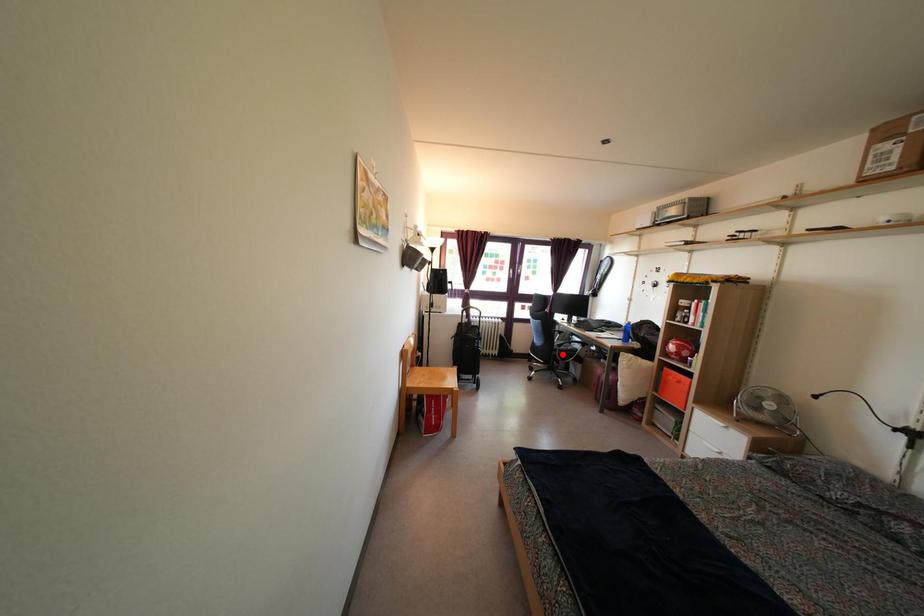
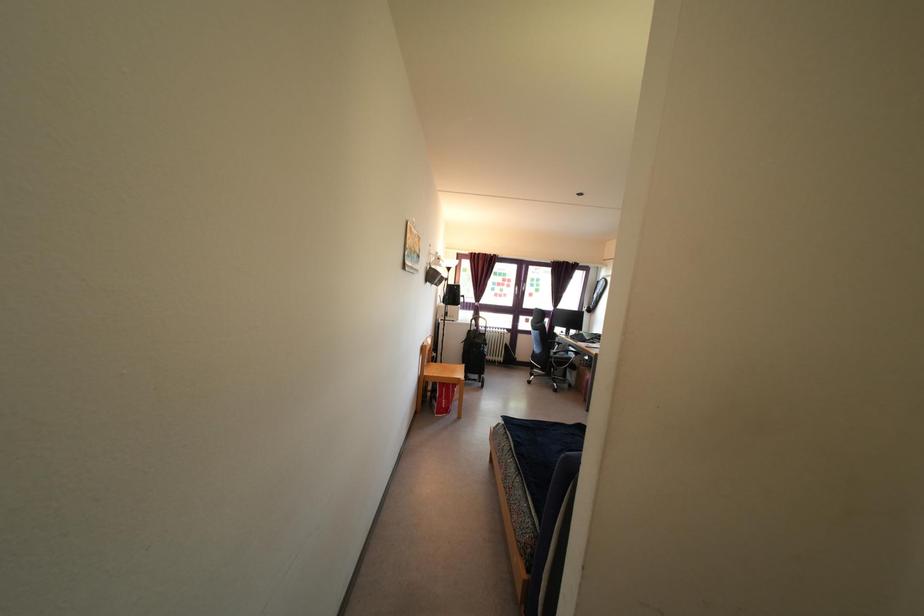
Locate, in the second image, the point that corresponds to the highlighted location in the first image.

(557, 362)